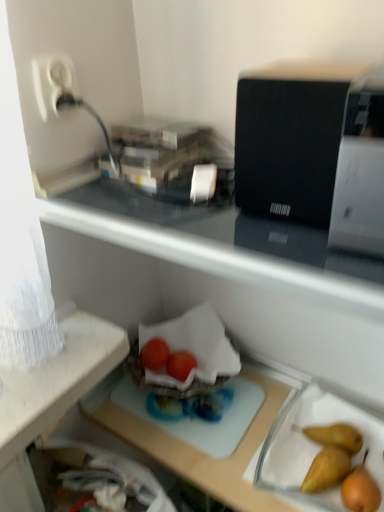
Find the location of `free space in front of glossy plastic tomatoes at center, which is the first green vegetables in right-to-left order`. free space in front of glossy plastic tomatoes at center, which is the first green vegetables in right-to-left order is located at coordinates (195, 415).